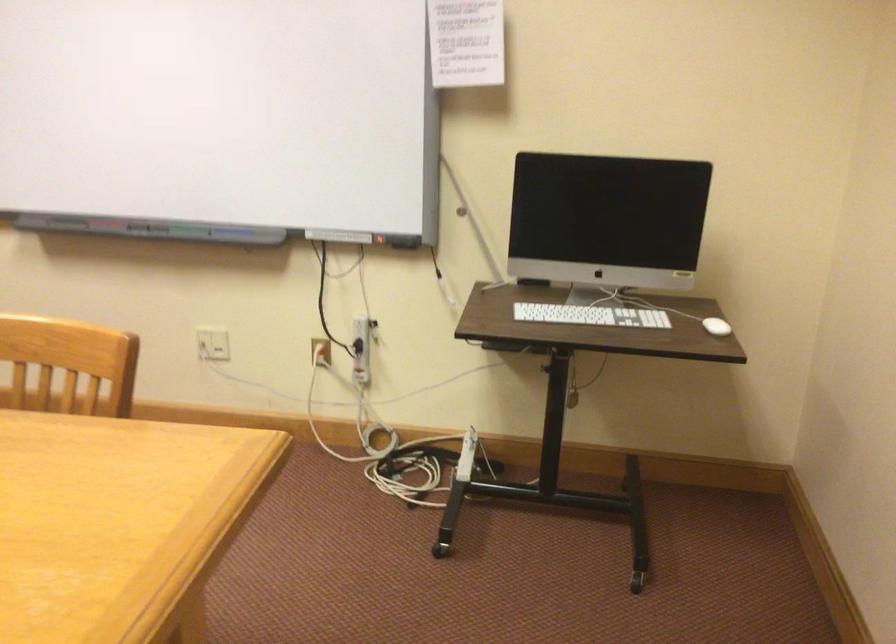
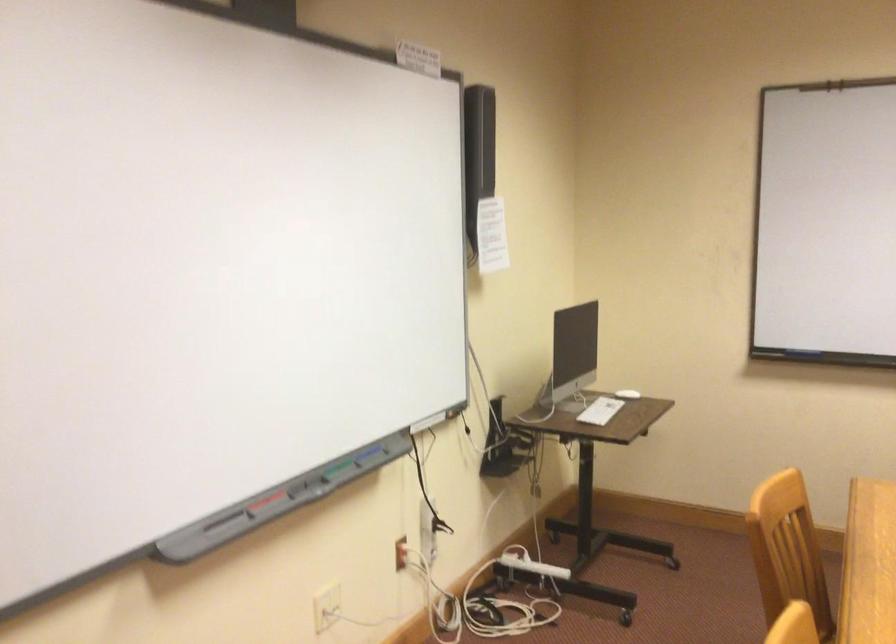
Find the pixel in the second image that matches point (674, 319) in the first image.

(627, 393)